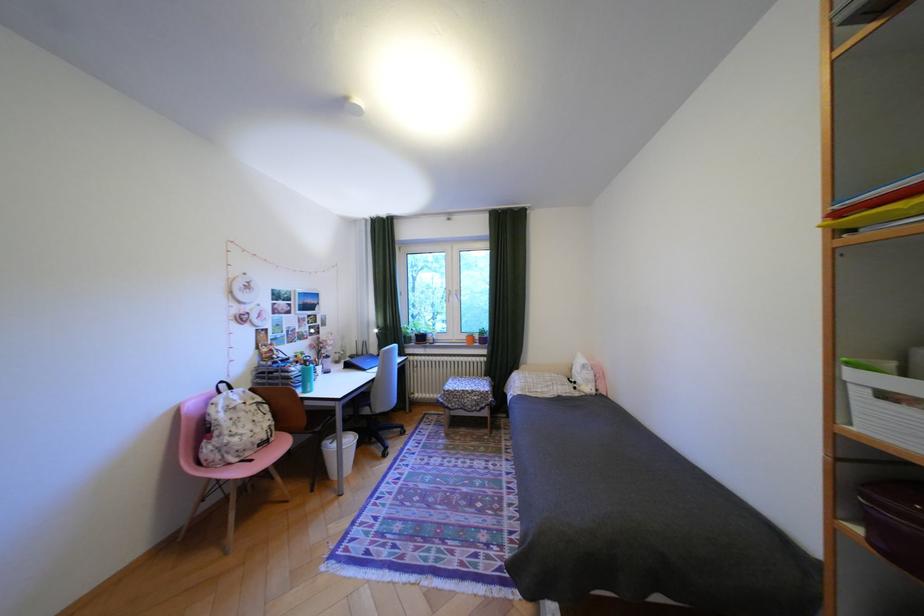
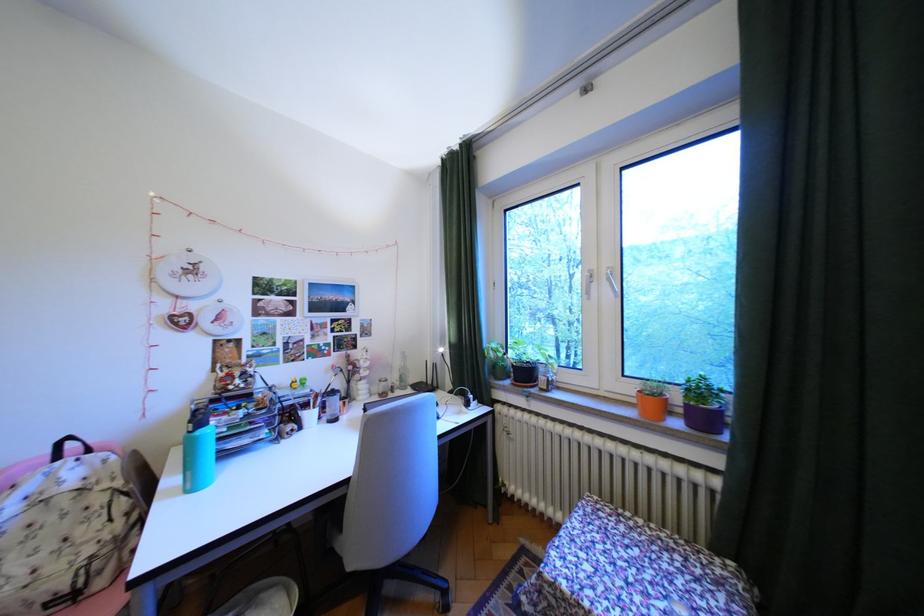
Find the pixel in the second image that matches the point at 476,337 in the first image.

(641, 390)